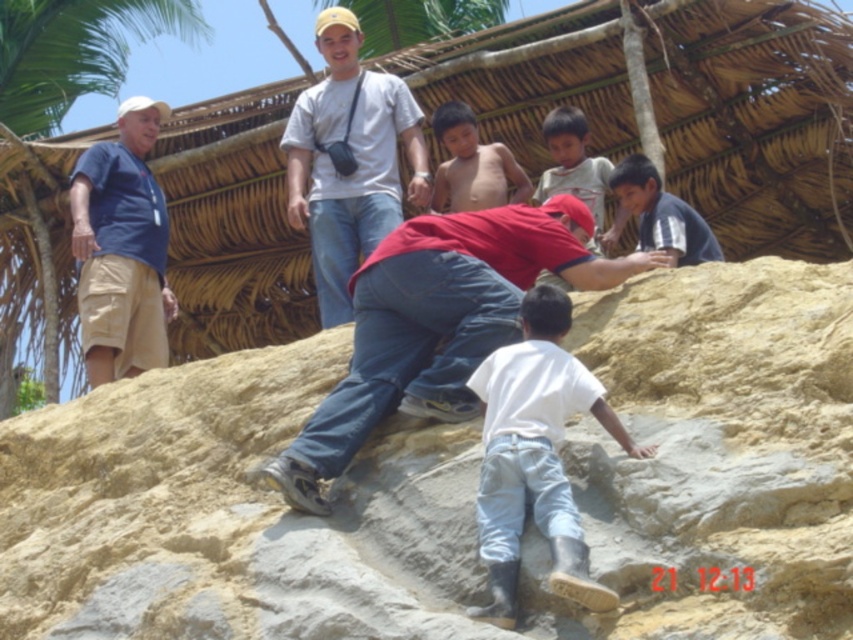
You are a photographer standing at the base of the rocky terrain. You want to take a photo that includes both the denim jeans at center and the green leafy palm tree at upper left. Which object should you focus on first to ensure both are in frame?

You should focus on the denim jeans at center first because it is shorter than the green leafy palm tree at upper left, so adjusting the camera angle to include the shorter object first will help capture both in the frame.

You are a photographer trying to capture a candid shot of the two subjects mentioned in the scene. Since you want to ensure both the skinny bare torso at center and the light brown skin at upper center are clearly visible in the frame, which one should you focus on first to avoid blurring due to their movement?

You should focus on the light brown skin at upper center first because it is taller than the skinny bare torso at center, making it more likely to be in focus and less likely to blur if they move.